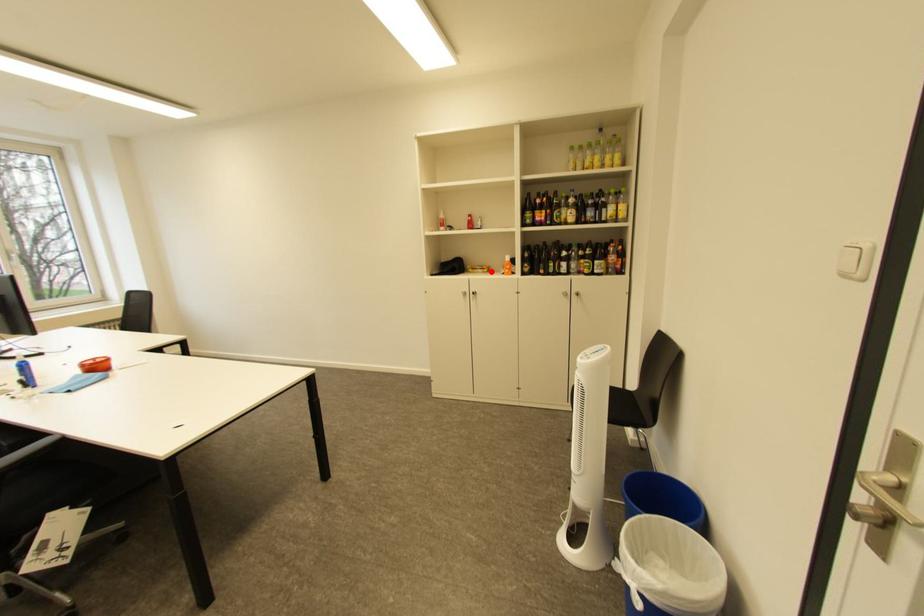
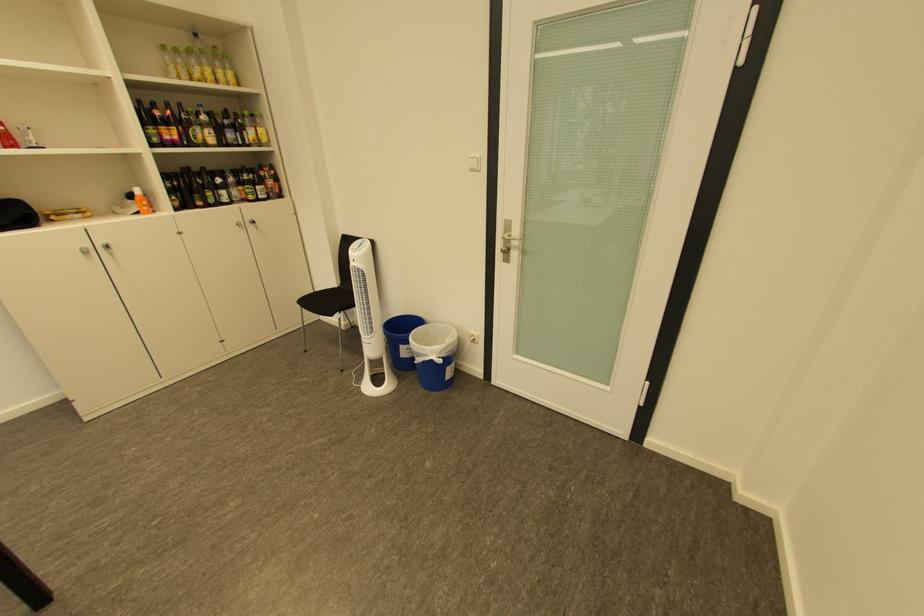
The point at the highlighted location is marked in the first image. Where is the corresponding point in the second image?

(90, 216)